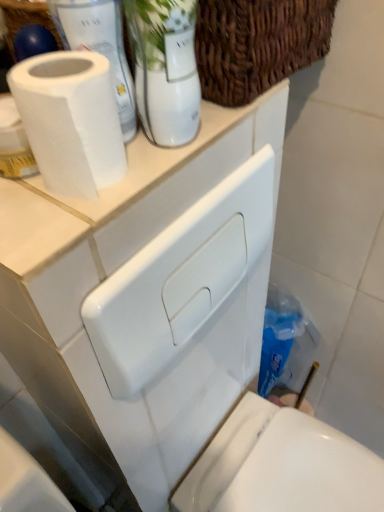
The height and width of the screenshot is (512, 384). Find the location of `vacant area on top of white glossy toilet at lower right (from a real-world perspective)`. vacant area on top of white glossy toilet at lower right (from a real-world perspective) is located at coordinates (295, 464).